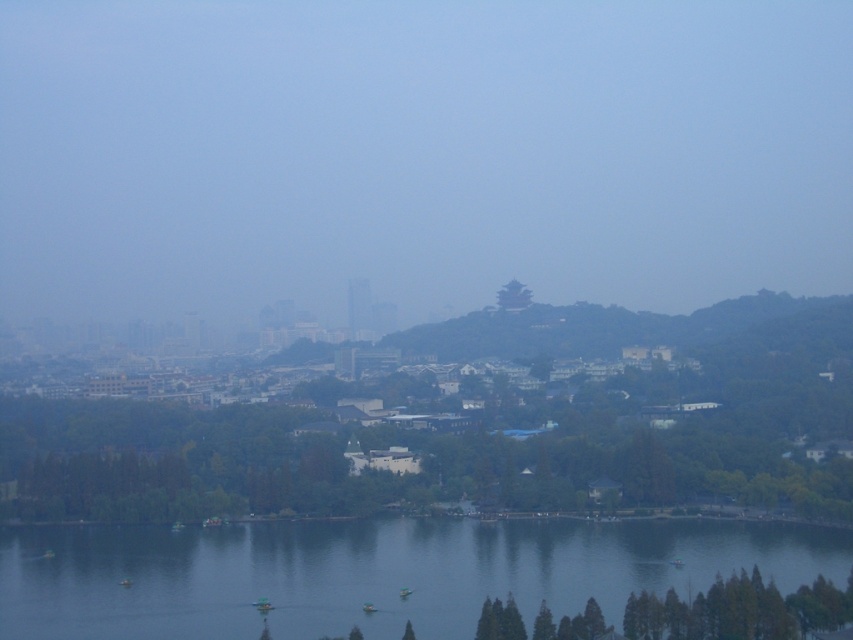
You are a photographer planning to take a picture of the cityscape. You want to ensure that both the clear blue water at lower center and the green matte pagoda at center are visible in the frame. Based on their relative sizes in the image, which object will appear larger in your photograph?

The clear blue water at lower center is taller than the green matte pagoda at center, so it will appear larger in the photograph.

Consider the image. You are standing on a bridge overlooking the city and want to take a photo of the green matte tree at center and the clear blue water at lower center. Which object will appear closer to you in the photo?

The green matte tree at center will appear closer to you in the photo because it is further to the viewer than the clear blue water at lower center.